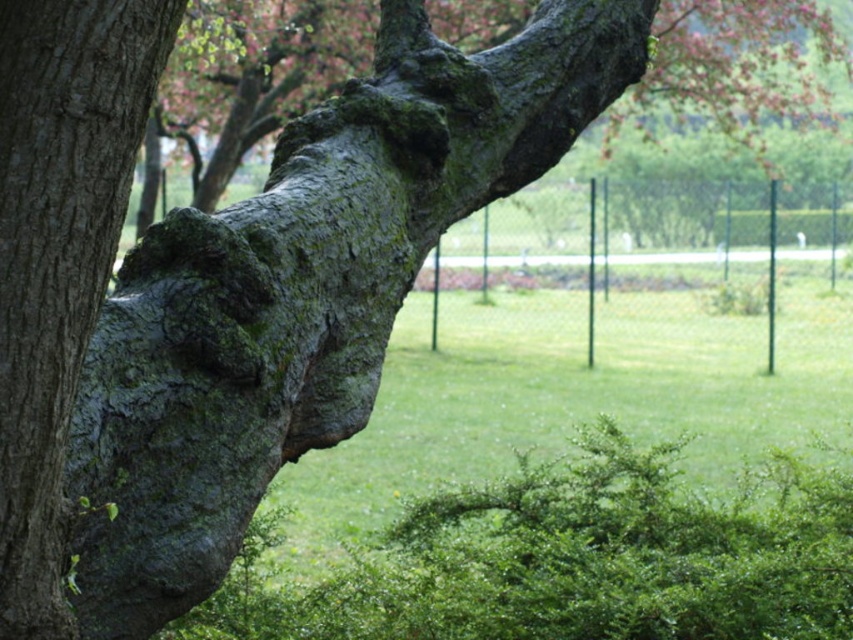
You are standing in a park and see the tree trunk and branch in the image. There is a specific point marked at coordinates [59,253]. What is located at this point on the tree?

The point at coordinates [59,253] corresponds to green mossy bark at center.

You are a gardener assessing the health of the tree. You notice the green mossy bark at center and the smooth bark tree trunk at center. Which part of the tree is located below the other?

The green mossy bark at center is positioned under the smooth bark tree trunk at center, meaning it is located below the smooth bark tree trunk.